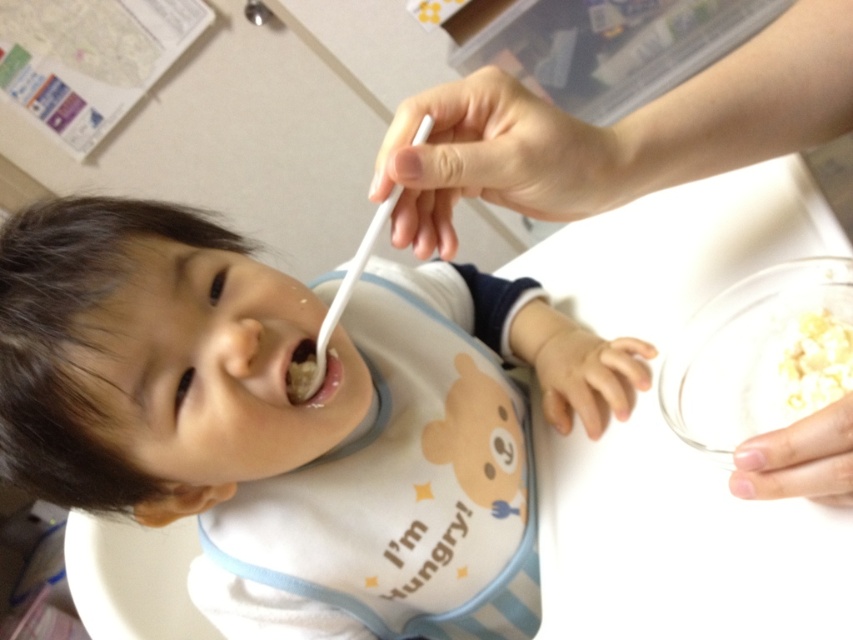
Question: Estimate the real-world distances between objects in this image. Which object is closer to the white plastic spoon at upper center?

Choices:
 (A) white plastic spoon at mouth
 (B) white matte cereal at upper right
 (C) white matte food at center

Answer: (A)

Question: Among these points, which one is nearest to the camera?

Choices:
 (A) (312, 387)
 (B) (527, 356)
 (C) (781, 352)

Answer: (C)

Question: Is white plastic spoon at upper center below white matte food at center?

Choices:
 (A) no
 (B) yes

Answer: (B)

Question: Is white matte cereal at upper right behind white matte food at center?

Choices:
 (A) no
 (B) yes

Answer: (A)

Question: Does white plastic spoon at upper center have a smaller size compared to white matte cereal at upper right?

Choices:
 (A) no
 (B) yes

Answer: (A)

Question: Which of the following is the farthest from the observer?

Choices:
 (A) white plastic spoon at upper center
 (B) white plastic spoon at mouth

Answer: (A)